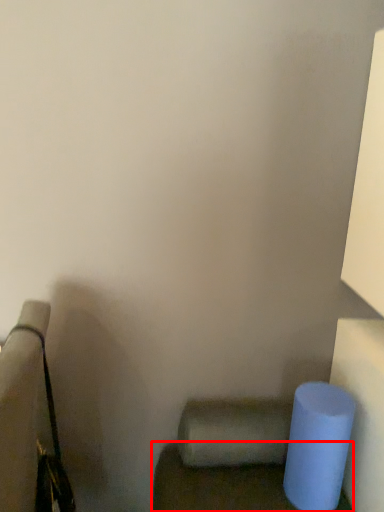
Question: From the image's perspective, where is furniture (annotated by the red box) located relative to toilet paper?

Choices:
 (A) above
 (B) below

Answer: (B)